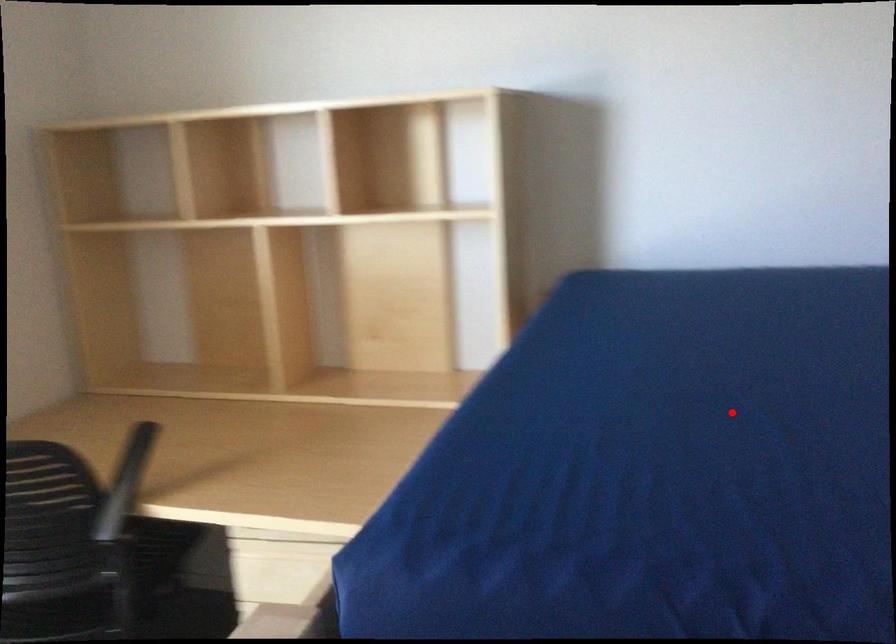
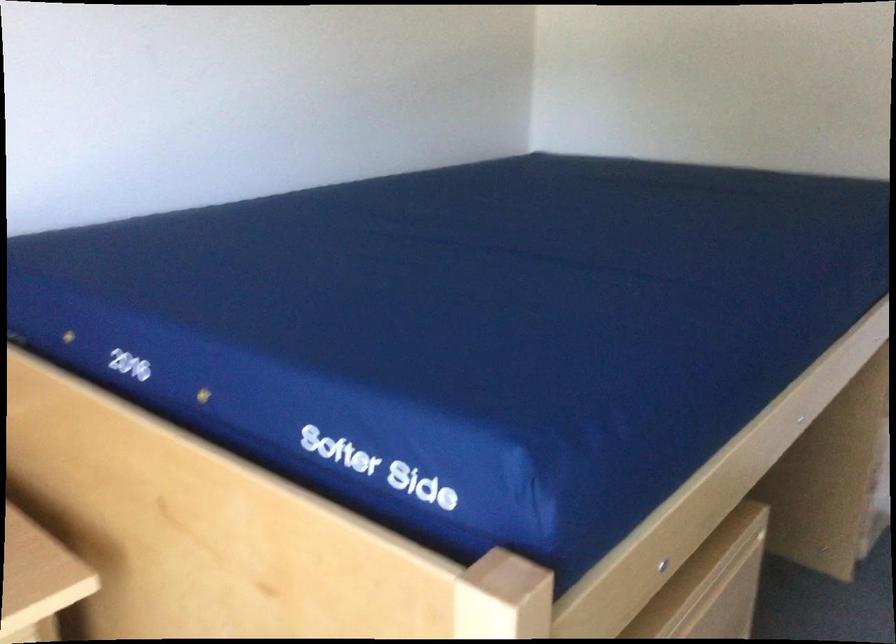
Where in the second image is the point corresponding to the highlighted location from the first image?

(469, 299)